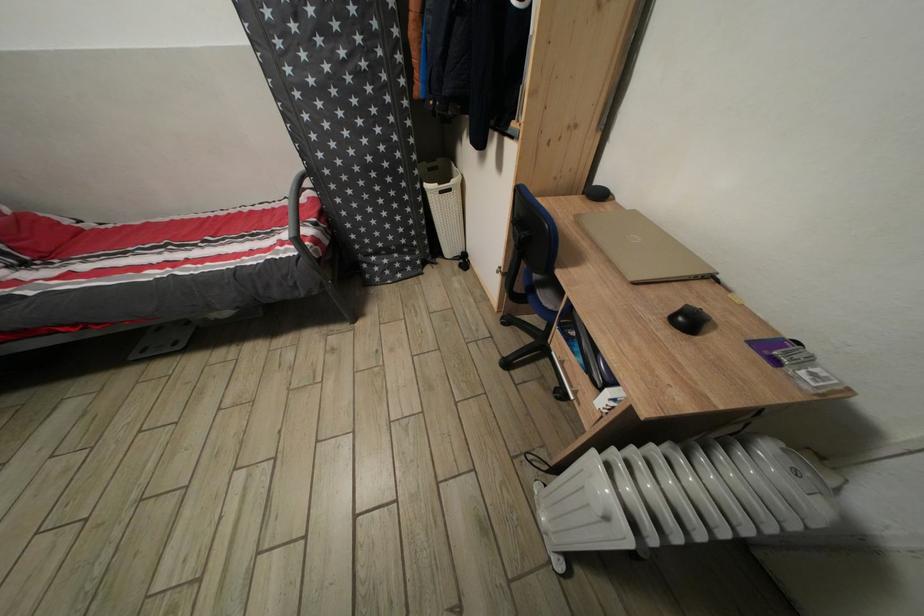
The image size is (924, 616). Describe the element at coordinates (536, 338) in the screenshot. I see `a chair sitting surface` at that location.